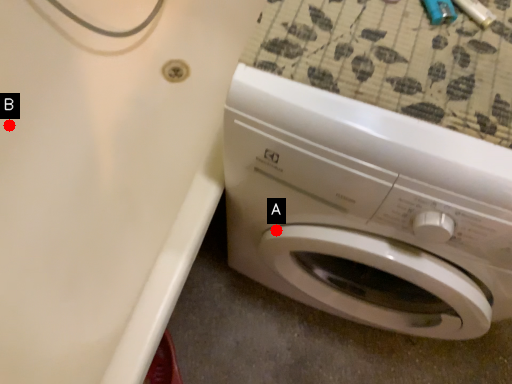
Question: Two points are circled on the image, labeled by A and B beside each circle. Which point appears closest to the camera in this image?

Choices:
 (A) A is closer
 (B) B is closer

Answer: (A)